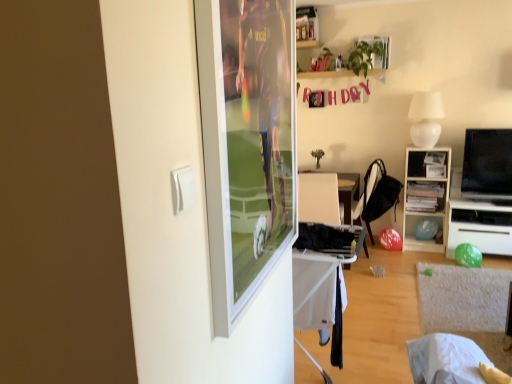
Question: Is black fabric chair at center with black fabric laundry at center?

Choices:
 (A) no
 (B) yes

Answer: (A)

Question: Is black fabric chair at center to the left of black fabric laundry at center from the viewer's perspective?

Choices:
 (A) no
 (B) yes

Answer: (A)

Question: From the image's perspective, is black fabric chair at center over black fabric laundry at center?

Choices:
 (A) yes
 (B) no

Answer: (A)

Question: From a real-world perspective, is black fabric chair at center located beneath black fabric laundry at center?

Choices:
 (A) no
 (B) yes

Answer: (B)

Question: Is the depth of black fabric chair at center greater than that of black fabric laundry at center?

Choices:
 (A) yes
 (B) no

Answer: (A)

Question: From a real-world perspective, is white fabric table at lower center above or below white matte lampshade at upper right?

Choices:
 (A) above
 (B) below

Answer: (B)

Question: Is white fabric table at lower center wider or thinner than white matte lampshade at upper right?

Choices:
 (A) wide
 (B) thin

Answer: (B)

Question: Is white fabric table at lower center taller or shorter than white matte lampshade at upper right?

Choices:
 (A) short
 (B) tall

Answer: (B)

Question: Is point (312, 271) positioned closer to the camera than point (422, 109)?

Choices:
 (A) farther
 (B) closer

Answer: (B)

Question: Considering their positions, is black fabric chair at center located in front of or behind white fabric table at lower center?

Choices:
 (A) behind
 (B) front

Answer: (A)

Question: Does point coord(366,178) appear closer or farther from the camera than point coord(328,291)?

Choices:
 (A) farther
 (B) closer

Answer: (A)

Question: Considering the positions of black fabric chair at center and white fabric table at lower center in the image, is black fabric chair at center taller or shorter than white fabric table at lower center?

Choices:
 (A) tall
 (B) short

Answer: (A)

Question: Considering the relative positions of black fabric chair at center and white fabric table at lower center in the image provided, is black fabric chair at center to the left or to the right of white fabric table at lower center?

Choices:
 (A) right
 (B) left

Answer: (A)

Question: Is point (430, 105) positioned closer to the camera than point (369, 223)?

Choices:
 (A) farther
 (B) closer

Answer: (B)

Question: From a real-world perspective, is white matte lampshade at upper right positioned above or below black fabric chair at center?

Choices:
 (A) below
 (B) above

Answer: (B)